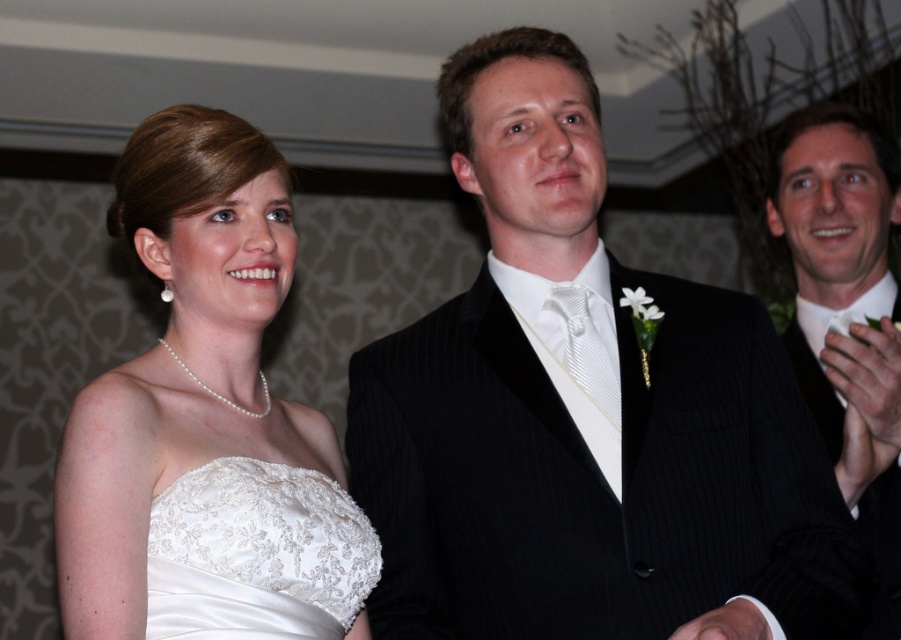
You are a photographer setting up for a group photo. You need to ensure both the white satin dress at left and the black pinstripe suit at right are fully visible in the frame. Based on their sizes, which one requires more horizontal space in the composition?

The white satin dress at left might be wider than the black pinstripe suit at right, so it requires more horizontal space in the composition to ensure it is fully visible.